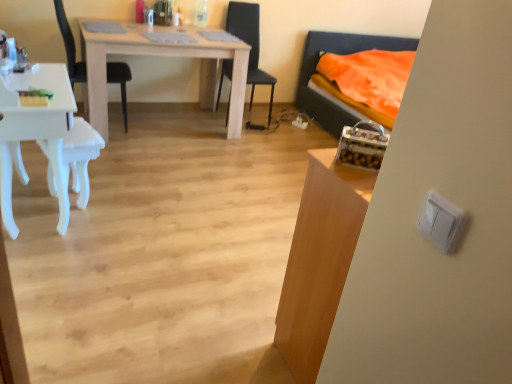
The image size is (512, 384). Find the location of `vacant area that lies between white glossy armchair at lower left and white glossy desk at left`. vacant area that lies between white glossy armchair at lower left and white glossy desk at left is located at coordinates (95, 221).